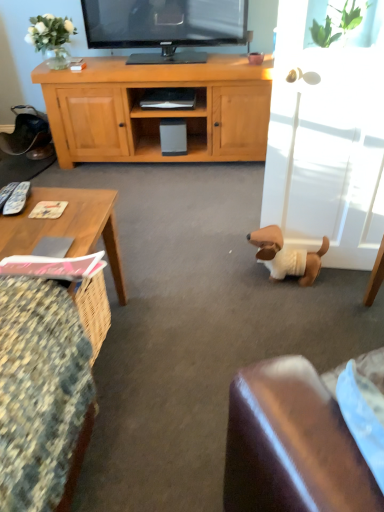
Question: Would you consider matte black shelf at center to be distant from white glossy glass door at right?

Choices:
 (A) yes
 (B) no

Answer: (A)

Question: Is white glossy glass door at right located within matte black shelf at center?

Choices:
 (A) no
 (B) yes

Answer: (A)

Question: Is matte black shelf at center not within white glossy glass door at right?

Choices:
 (A) no
 (B) yes

Answer: (B)

Question: Considering the relative sizes of matte black shelf at center and white glossy glass door at right in the image provided, is matte black shelf at center shorter than white glossy glass door at right?

Choices:
 (A) no
 (B) yes

Answer: (B)

Question: From the image's perspective, is matte black shelf at center below white glossy glass door at right?

Choices:
 (A) yes
 (B) no

Answer: (B)

Question: Does matte black shelf at center have a lesser width compared to white glossy glass door at right?

Choices:
 (A) no
 (B) yes

Answer: (B)

Question: Are white glossy glass door at right and matte black shelf at center located far from each other?

Choices:
 (A) no
 (B) yes

Answer: (B)

Question: Is white glossy glass door at right further to camera compared to matte black shelf at center?

Choices:
 (A) yes
 (B) no

Answer: (B)

Question: From the image's perspective, is white glossy glass door at right below matte black shelf at center?

Choices:
 (A) no
 (B) yes

Answer: (B)

Question: Can you confirm if white glossy glass door at right is bigger than matte black shelf at center?

Choices:
 (A) yes
 (B) no

Answer: (A)

Question: Does white glossy glass door at right appear on the right side of matte black shelf at center?

Choices:
 (A) yes
 (B) no

Answer: (A)

Question: From a real-world perspective, is white glossy glass door at right under matte black shelf at center?

Choices:
 (A) no
 (B) yes

Answer: (A)

Question: Is wooden textured coffee table at lower left to the left of matte black shelf at center from the viewer's perspective?

Choices:
 (A) yes
 (B) no

Answer: (A)